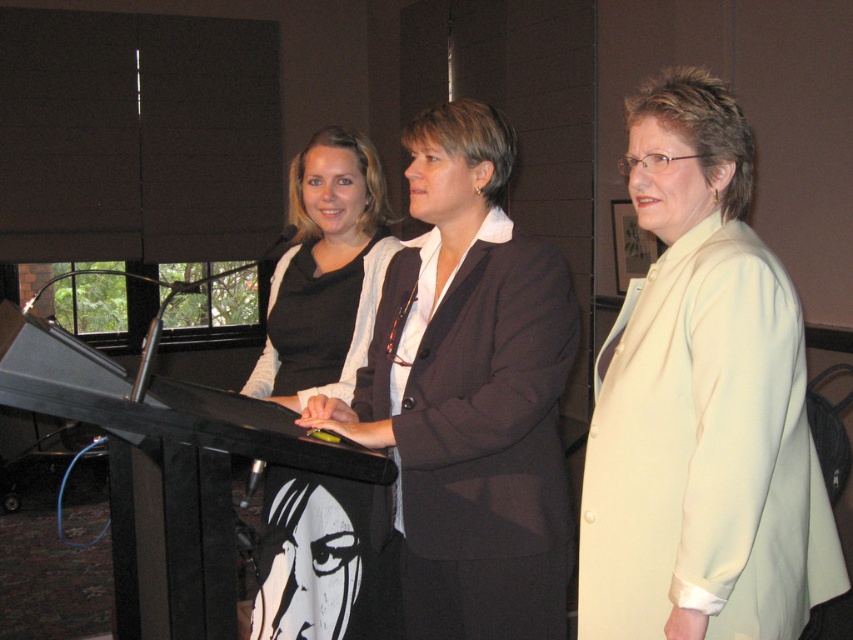
Can you confirm if black wood podium at center is shorter than matte black dress at center?

No, black wood podium at center is not shorter than matte black dress at center.

Who is shorter, black wood podium at center or matte black dress at center?

Standing shorter between the two is matte black dress at center.

Does point (173, 600) come farther from viewer compared to point (328, 312)?

No, (173, 600) is closer to viewer.

The image size is (853, 640). In order to click on black wood podium at center in this screenshot , I will do `click(165, 467)`.

Is matte black blazer at center positioned at the back of matte black dress at center?

No.

Which of these two, matte black blazer at center or matte black dress at center, stands taller?

Standing taller between the two is matte black blazer at center.

Between point (432, 554) and point (345, 198), which one is positioned behind?

Positioned behind is point (345, 198).

In order to click on matte black blazer at center in this screenshot , I will do `click(469, 394)`.

Is point (682, 554) farther from viewer compared to point (440, 502)?

No, (682, 554) is closer to viewer.

Is white satin blazer at center behind matte black blazer at center?

No.

This screenshot has width=853, height=640. Describe the element at coordinates (701, 404) in the screenshot. I see `white satin blazer at center` at that location.

Find the location of a particular element. white satin blazer at center is located at coordinates (701, 404).